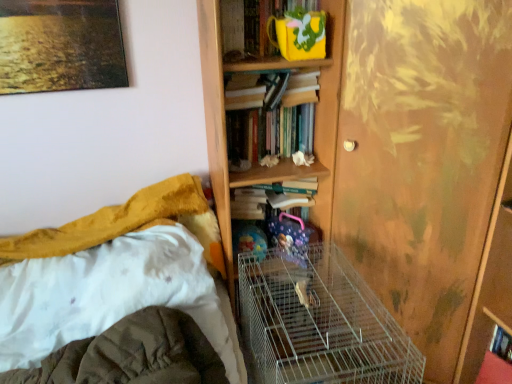
This screenshot has height=384, width=512. What do you see at coordinates (277, 212) in the screenshot?
I see `hardcover book at center, the first book positioned from the bottom` at bounding box center [277, 212].

What is the approximate width of white soft blanket at lower left?

16.74 inches.

What do you see at coordinates (114, 274) in the screenshot?
I see `white fabric bed at lower left` at bounding box center [114, 274].

What is the approximate width of wooden screen door at right?

The width of wooden screen door at right is 15.53 inches.

Where is `matte purple plush toy at center, placed as the 1th toy when sorted from right to left`? matte purple plush toy at center, placed as the 1th toy when sorted from right to left is located at coordinates (291, 237).

Which object is further away from the camera taking this photo, yellow fabric book at upper center, which is the 1th book from top to bottom, or translucent plastic ball at center, placed as the 1th toy when sorted from left to right?

translucent plastic ball at center, placed as the 1th toy when sorted from left to right, is further from the camera.

From the image's perspective, is yellow fabric book at upper center, acting as the 3th book starting from the bottom, above or below translucent plastic ball at center, the second toy viewed from the right?

yellow fabric book at upper center, acting as the 3th book starting from the bottom, is above translucent plastic ball at center, the second toy viewed from the right.

Based on the photo, considering the relative positions of yellow fabric book at upper center, acting as the 3th book starting from the bottom, and translucent plastic ball at center, placed as the 1th toy when sorted from left to right, in the image provided, is yellow fabric book at upper center, acting as the 3th book starting from the bottom, to the right of translucent plastic ball at center, placed as the 1th toy when sorted from left to right, from the viewer's perspective?

Indeed, yellow fabric book at upper center, acting as the 3th book starting from the bottom, is positioned on the right side of translucent plastic ball at center, placed as the 1th toy when sorted from left to right.

Which of these two, yellow fabric book at upper center, which is the 1th book from top to bottom, or translucent plastic ball at center, placed as the 1th toy when sorted from left to right, is bigger?

With larger size is yellow fabric book at upper center, which is the 1th book from top to bottom.

What's the angular difference between matte purple plush toy at center, placed as the 1th toy when sorted from right to left, and wooden bookcase at upper center's facing directions?

The facing directions of matte purple plush toy at center, placed as the 1th toy when sorted from right to left, and wooden bookcase at upper center are 49.6 degrees apart.

Which of these two, matte purple plush toy at center, the second toy viewed from the left, or wooden bookcase at upper center, is bigger?

wooden bookcase at upper center.

Could you tell me if matte purple plush toy at center, placed as the 1th toy when sorted from right to left, is facing wooden bookcase at upper center?

Yes, matte purple plush toy at center, placed as the 1th toy when sorted from right to left, is facing wooden bookcase at upper center.

Considering the sizes of matte purple plush toy at center, the second toy viewed from the left, and wooden bookcase at upper center in the image, is matte purple plush toy at center, the second toy viewed from the left, wider or thinner than wooden bookcase at upper center?

Clearly, matte purple plush toy at center, the second toy viewed from the left, has less width compared to wooden bookcase at upper center.

Can you tell me how much wooden bookcase at upper center and hardcover books at center, which ranks as the second book in top-to-bottom order, differ in facing direction?

The facing directions of wooden bookcase at upper center and hardcover books at center, which ranks as the second book in top-to-bottom order, are 1.51 degrees apart.

How far apart are wooden bookcase at upper center and hardcover books at center, which ranks as the second book in top-to-bottom order?

wooden bookcase at upper center and hardcover books at center, which ranks as the second book in top-to-bottom order, are 4.11 inches apart.

Can you confirm if wooden bookcase at upper center is smaller than hardcover books at center, which appears as the second book when ordered from the bottom?

No.

Where is `bookcase on the left of hardcover books at center, which ranks as the second book in top-to-bottom order`? This screenshot has height=384, width=512. bookcase on the left of hardcover books at center, which ranks as the second book in top-to-bottom order is located at coordinates (287, 159).

Can you tell me how much hardcover books at center, which ranks as the second book in top-to-bottom order, and white soft blanket at lower left differ in facing direction?

The angle between the facing direction of hardcover books at center, which ranks as the second book in top-to-bottom order, and the facing direction of white soft blanket at lower left is 0.612 degrees.

From a real-world perspective, is hardcover books at center, which appears as the second book when ordered from the bottom, above or below white soft blanket at lower left?

From a real-world perspective, hardcover books at center, which appears as the second book when ordered from the bottom, is physically above white soft blanket at lower left.

Is hardcover books at center, which appears as the second book when ordered from the bottom, facing away from white soft blanket at lower left?

That's not correct — hardcover books at center, which appears as the second book when ordered from the bottom, is not looking away from white soft blanket at lower left.

I want to click on book that is the 2nd object above the white soft blanket at lower left (from a real-world perspective), so click(x=271, y=116).

From the image's perspective, which object appears higher, white soft blanket at lower left or wooden bookcase at upper center?

wooden bookcase at upper center is shown above in the image.

Can you confirm if white soft blanket at lower left is taller than wooden bookcase at upper center?

In fact, white soft blanket at lower left may be shorter than wooden bookcase at upper center.

Identify the location of blanket that is in front of the wooden bookcase at upper center. Image resolution: width=512 pixels, height=384 pixels. (132, 355).

In the scene shown: Is wooden bookcase at upper center located within white soft blanket at lower left?

No, wooden bookcase at upper center is not inside white soft blanket at lower left.

Image resolution: width=512 pixels, height=384 pixels. Find the location of `the 2nd toy counting from the left side of the wooden screen door at right`. the 2nd toy counting from the left side of the wooden screen door at right is located at coordinates (250, 241).

From a real-world perspective, is translucent plastic ball at center, placed as the 1th toy when sorted from left to right, physically located above or below wooden screen door at right?

Clearly, from a real-world perspective, translucent plastic ball at center, placed as the 1th toy when sorted from left to right, is below wooden screen door at right.

Is the position of translucent plastic ball at center, the second toy viewed from the right, less distant than that of wooden screen door at right?

No, it is behind wooden screen door at right.

Which is behind, point (273, 217) or point (278, 377)?

The point (273, 217) is farther from the camera.

From a real-world perspective, between matte purple plush toy at center, the second toy viewed from the left, and silver wire birdcage at center, who is vertically lower?

silver wire birdcage at center.

Between matte purple plush toy at center, placed as the 1th toy when sorted from right to left, and silver wire birdcage at center, which one has less height?

Standing shorter between the two is matte purple plush toy at center, placed as the 1th toy when sorted from right to left.

Image resolution: width=512 pixels, height=384 pixels. Identify the location of bird cage below the matte purple plush toy at center, the second toy viewed from the left (from the image's perspective). (320, 323).

From the image's perspective, starting from the translucent plastic ball at center, the second toy viewed from the right, which book is the 3rd one above? Please provide its 2D coordinates.

[(271, 31)]

You are a GUI agent. You are given a task and a screenshot of the screen. Output one action in this format:
    pyautogui.click(x=<x>, y=<y>)
    Task: Click on the bookcase in front of the matte purple plush toy at center, the second toy viewed from the left
    Image resolution: width=512 pixels, height=384 pixels.
    Given the screenshot: What is the action you would take?
    pyautogui.click(x=287, y=159)

Looking at the image, which one is located closer to white fabric bed at lower left, wooden bookcase at upper center or silver wire birdcage at center?

silver wire birdcage at center is positioned closer to the anchor white fabric bed at lower left.

Considering their positions, is hardcover book at center, the first book positioned from the bottom, positioned further to white fabric bed at lower left than matte purple plush toy at center, the second toy viewed from the left?

matte purple plush toy at center, the second toy viewed from the left, is positioned further to the anchor white fabric bed at lower left.

Looking at the image, which one is located further to hardcover book at center, the third book in the top-to-bottom sequence, matte purple plush toy at center, the second toy viewed from the left, or hardcover books at center, which ranks as the second book in top-to-bottom order?

The object further to hardcover book at center, the third book in the top-to-bottom sequence, is hardcover books at center, which ranks as the second book in top-to-bottom order.

Which object lies further to the anchor point silver wire birdcage at center, hardcover book at center, the third book in the top-to-bottom sequence, or matte purple plush toy at center, the second toy viewed from the left?

Based on the image, hardcover book at center, the third book in the top-to-bottom sequence, appears to be further to silver wire birdcage at center.

From the image, which object appears to be nearer to yellow fabric book at upper center, acting as the 3th book starting from the bottom, hardcover books at center, which ranks as the second book in top-to-bottom order, or white fabric bed at lower left?

The object closer to yellow fabric book at upper center, acting as the 3th book starting from the bottom, is hardcover books at center, which ranks as the second book in top-to-bottom order.

Which object lies nearer to the anchor point yellow fabric book at upper center, which is the 1th book from top to bottom, matte purple plush toy at center, placed as the 1th toy when sorted from right to left, or silver wire birdcage at center?

matte purple plush toy at center, placed as the 1th toy when sorted from right to left, lies closer to yellow fabric book at upper center, which is the 1th book from top to bottom, than the other object.

Estimate the real-world distances between objects in this image. Which object is closer to matte purple plush toy at center, the second toy viewed from the left, white fabric bed at lower left or hardcover book at center, the first book positioned from the bottom?

The object closer to matte purple plush toy at center, the second toy viewed from the left, is hardcover book at center, the first book positioned from the bottom.

Which object lies nearer to the anchor point silver wire birdcage at center, white fabric bed at lower left or yellow fabric book at upper center, which is the 1th book from top to bottom?

white fabric bed at lower left.

Locate an element on the screen. The image size is (512, 384). blanket between yellow fabric book at upper center, acting as the 3th book starting from the bottom, and white fabric bed at lower left from top to bottom is located at coordinates (132, 355).

Locate an element on the screen. This screenshot has height=384, width=512. toy located between wooden screen door at right and translucent plastic ball at center, the second toy viewed from the right, in the depth direction is located at coordinates [x=291, y=237].

Locate an element on the screen. Image resolution: width=512 pixels, height=384 pixels. screen door between yellow fabric book at upper center, acting as the 3th book starting from the bottom, and silver wire birdcage at center vertically is located at coordinates (423, 158).

At what (x,y) coordinates should I click in order to perform the action: click on toy positioned between silver wire birdcage at center and translucent plastic ball at center, the second toy viewed from the right, from near to far. Please return your answer as a coordinate pair (x, y). The image size is (512, 384). Looking at the image, I should click on (291, 237).